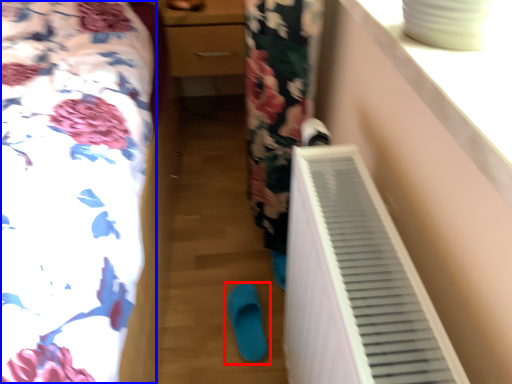
Question: Which of the following is the closest to the observer, footwear (highlighted by a red box) or furniture (highlighted by a blue box)?

Choices:
 (A) footwear
 (B) furniture

Answer: (B)